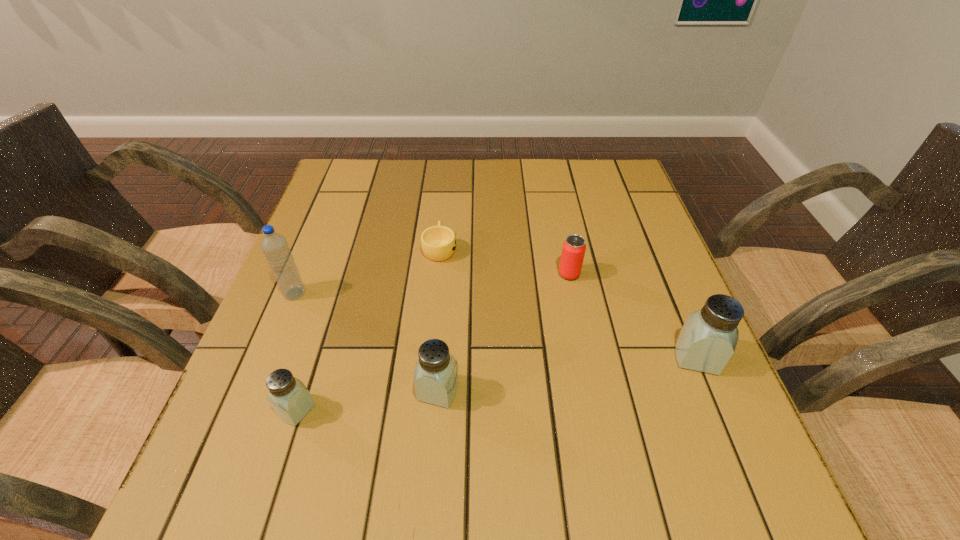
Find the location of a particular element. Image resolution: width=960 pixels, height=540 pixels. object that is at the right edge is located at coordinates (708, 338).

You are a GUI agent. You are given a task and a screenshot of the screen. Output one action in this format:
    pyautogui.click(x=<x>, y=<y>)
    Task: Click on the object located at the near left corner
    
    Given the screenshot: What is the action you would take?
    pyautogui.click(x=290, y=399)

In the image, there is a desktop. Where is `vacant space at the far edge`? vacant space at the far edge is located at coordinates (486, 169).

Find the location of a particular element. Image resolution: width=960 pixels, height=540 pixels. vacant space at the near edge of the desktop is located at coordinates (480, 437).

The width and height of the screenshot is (960, 540). Find the location of `blank space at the left edge of the desktop`. blank space at the left edge of the desktop is located at coordinates (332, 230).

In the image, there is a desktop. Where is `vacant space at the right edge`? vacant space at the right edge is located at coordinates (686, 317).

Locate an element on the screen. The height and width of the screenshot is (540, 960). blank area at the far left corner is located at coordinates (379, 188).

Find the location of a particular element. This screenshot has height=540, width=960. free space at the far right corner is located at coordinates tap(617, 192).

Where is `vacant point located between the second saltshaker from left to right and the leftmost saltshaker`? vacant point located between the second saltshaker from left to right and the leftmost saltshaker is located at coordinates (368, 400).

I want to click on free point between the third farthest object and the second tallest object, so click(x=495, y=325).